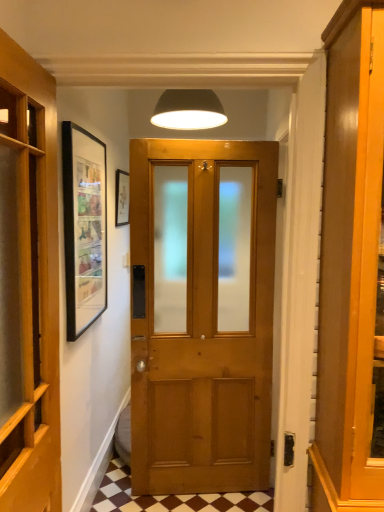
Question: Looking at the image, does white matte lampshade at upper center seem bigger or smaller compared to matte black picture frame at upper left?

Choices:
 (A) small
 (B) big

Answer: (B)

Question: From a real-world perspective, is white matte lampshade at upper center positioned above or below matte black picture frame at upper left?

Choices:
 (A) below
 (B) above

Answer: (B)

Question: Which object is positioned closest to the wooden door at left?

Choices:
 (A) matte black picture frame at upper left
 (B) white matte lampshade at upper center
 (C) brown checkered tile at center

Answer: (B)

Question: Based on their relative distances, which object is nearer to the white matte lampshade at upper center?

Choices:
 (A) matte black picture frame at upper left
 (B) brown checkered tile at center
 (C) wooden door at left

Answer: (A)